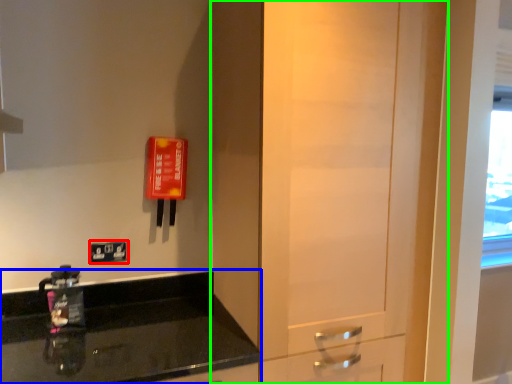
Question: Considering the real-world distances, which object is closest to light switch (highlighted by a red box)? countertop (highlighted by a blue box) or door (highlighted by a green box).

Choices:
 (A) countertop
 (B) door

Answer: (A)